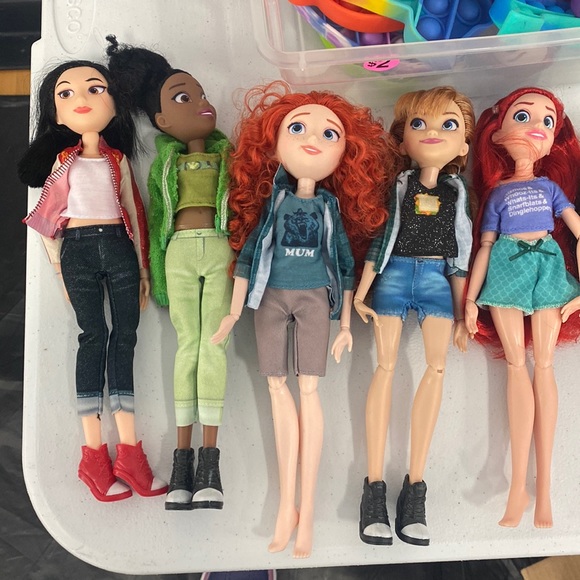
Identify the location of trays. The height and width of the screenshot is (580, 580). (137, 524).